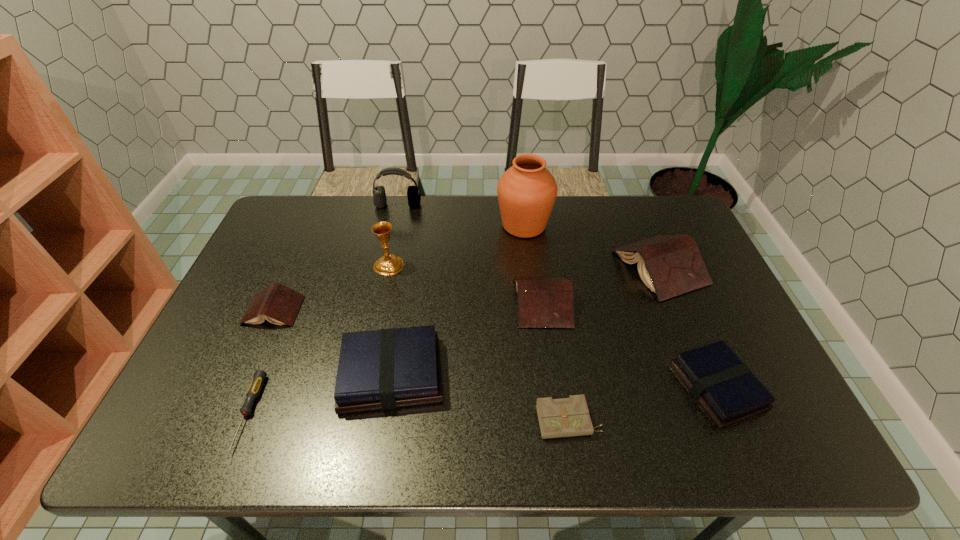
The image size is (960, 540). I want to click on free space that satisfies the following two spatial constraints: 1. on the headband of the urn; 2. on the right side of the headset, so click(x=394, y=225).

The width and height of the screenshot is (960, 540). Identify the location of free space in the image that satisfies the following two spatial constraints: 1. on the headband of the tallest book; 2. on the right side of the headset. (384, 267).

I want to click on free space that satisfies the following two spatial constraints: 1. on the headband of the second book from left to right; 2. on the right side of the black headset, so click(360, 374).

Image resolution: width=960 pixels, height=540 pixels. Find the location of `blank space that satisfies the following two spatial constraints: 1. on the headband of the second biggest brown book; 2. on the left side of the headset`. blank space that satisfies the following two spatial constraints: 1. on the headband of the second biggest brown book; 2. on the left side of the headset is located at coordinates (376, 302).

The height and width of the screenshot is (540, 960). Find the location of `free location that satisfies the following two spatial constraints: 1. on the front side of the fourth book from right to left; 2. on the right side of the chalice`. free location that satisfies the following two spatial constraints: 1. on the front side of the fourth book from right to left; 2. on the right side of the chalice is located at coordinates (366, 374).

Locate an element on the screen. Image resolution: width=960 pixels, height=540 pixels. free space that satisfies the following two spatial constraints: 1. on the headband of the diary; 2. on the left side of the headset is located at coordinates click(x=350, y=421).